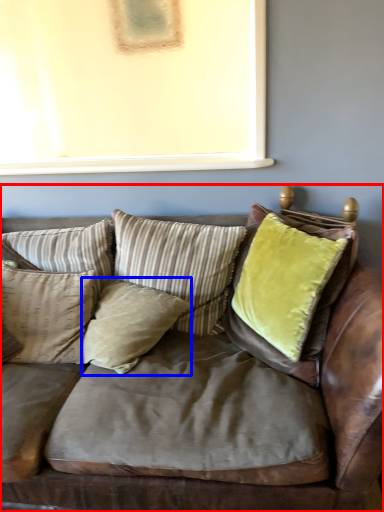
Question: Among these objects, which one is farthest to the camera, studio couch (highlighted by a red box) or pillow (highlighted by a blue box)?

Choices:
 (A) studio couch
 (B) pillow

Answer: (B)